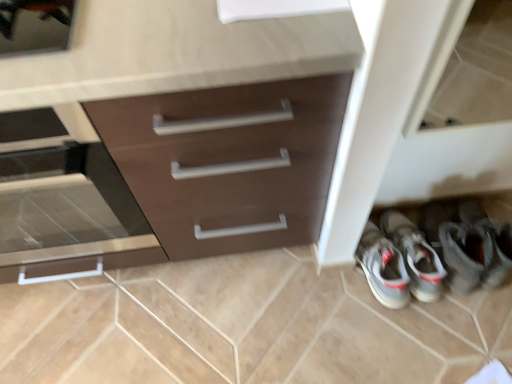
Question: Should I look upward or downward to see matte brown drawer at left?

Choices:
 (A) up
 (B) down

Answer: (A)

Question: From the image's perspective, would you say matte brown drawer at left is positioned over brown matte cabinet at center?

Choices:
 (A) yes
 (B) no

Answer: (B)

Question: Are matte brown drawer at left and brown matte cabinet at center beside each other?

Choices:
 (A) no
 (B) yes

Answer: (A)

Question: From a real-world perspective, is matte brown drawer at left positioned under brown matte cabinet at center based on gravity?

Choices:
 (A) no
 (B) yes

Answer: (A)

Question: Is matte brown drawer at left bigger than brown matte cabinet at center?

Choices:
 (A) no
 (B) yes

Answer: (A)

Question: Can you confirm if matte brown drawer at left is thinner than brown matte cabinet at center?

Choices:
 (A) yes
 (B) no

Answer: (A)

Question: Is matte brown drawer at left at the left side of brown matte cabinet at center?

Choices:
 (A) no
 (B) yes

Answer: (B)

Question: Is matte brown drawer at left not close to gray fabric sneakers at lower right?

Choices:
 (A) no
 (B) yes

Answer: (A)

Question: Considering the relative sizes of matte brown drawer at left and gray fabric sneakers at lower right in the image provided, is matte brown drawer at left wider than gray fabric sneakers at lower right?

Choices:
 (A) yes
 (B) no

Answer: (A)

Question: Can you confirm if matte brown drawer at left is bigger than gray fabric sneakers at lower right?

Choices:
 (A) yes
 (B) no

Answer: (A)

Question: Considering the relative positions of matte brown drawer at left and gray fabric sneakers at lower right in the image provided, is matte brown drawer at left to the left of gray fabric sneakers at lower right from the viewer's perspective?

Choices:
 (A) no
 (B) yes

Answer: (B)

Question: Does matte brown drawer at left have a greater height compared to gray fabric sneakers at lower right?

Choices:
 (A) no
 (B) yes

Answer: (B)

Question: Does matte brown drawer at left come in front of gray fabric sneakers at lower right?

Choices:
 (A) no
 (B) yes

Answer: (B)

Question: Is gray fabric sneakers at lower right to the left of matte brown drawer at left from the viewer's perspective?

Choices:
 (A) no
 (B) yes

Answer: (A)